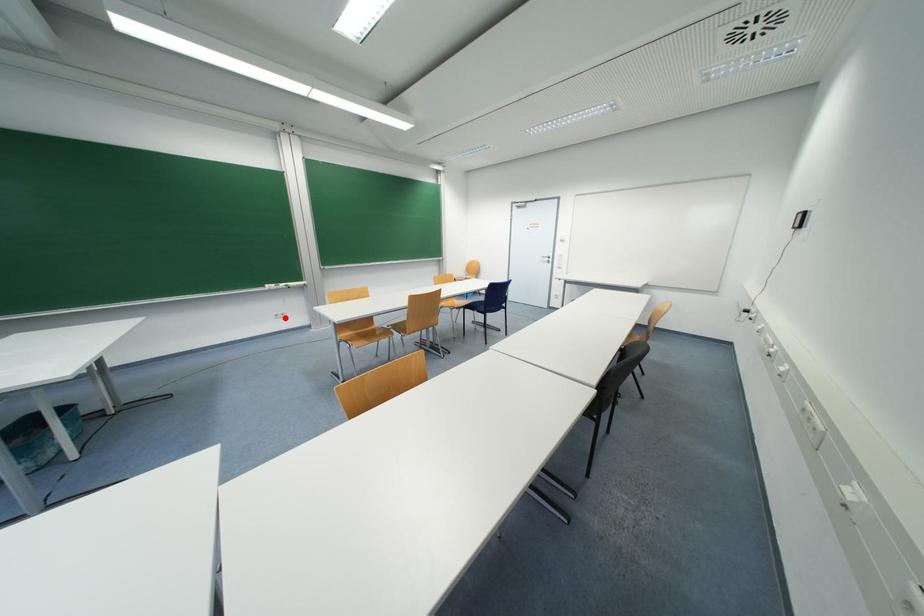
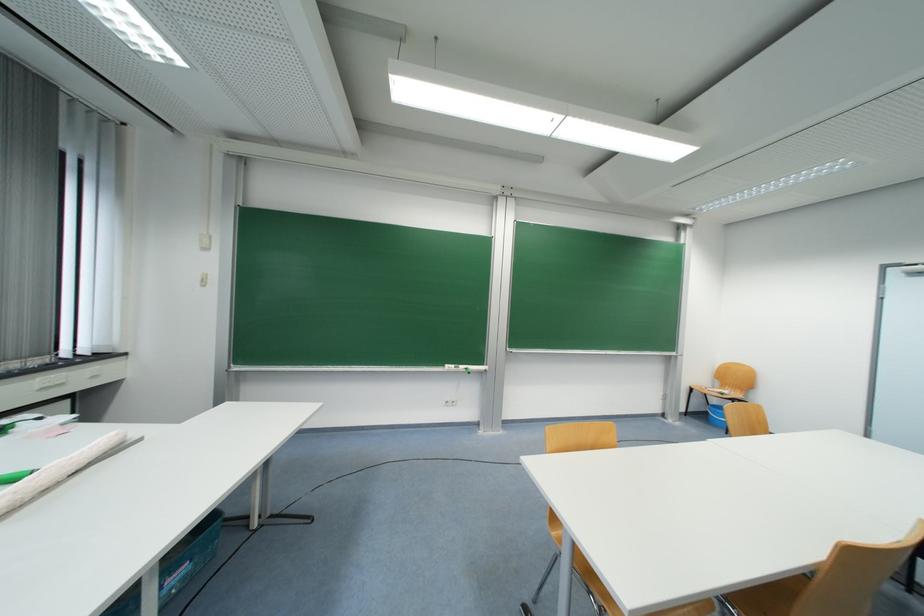
The point at the highlighted location is marked in the first image. Where is the corresponding point in the second image?

(455, 406)